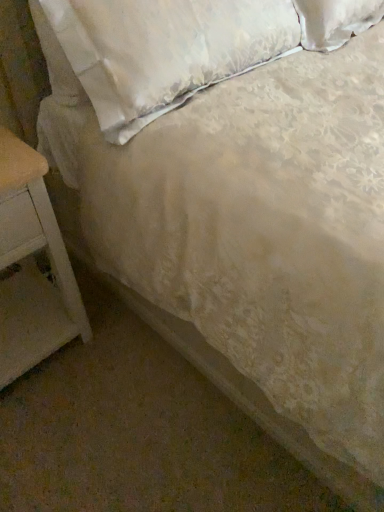
The image size is (384, 512). What are the coordinates of `unoccupied region to the right of white wood nightstand at lower left` in the screenshot? It's located at (122, 357).